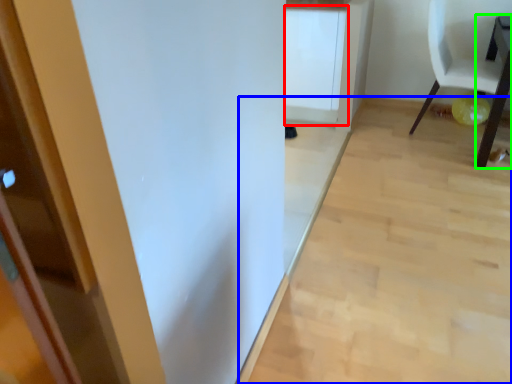
Question: Based on their relative distances, which object is nearer to cabinetry (highlighted by a red box)? Choose from plain (highlighted by a blue box) and table (highlighted by a green box).

Choices:
 (A) plain
 (B) table

Answer: (A)